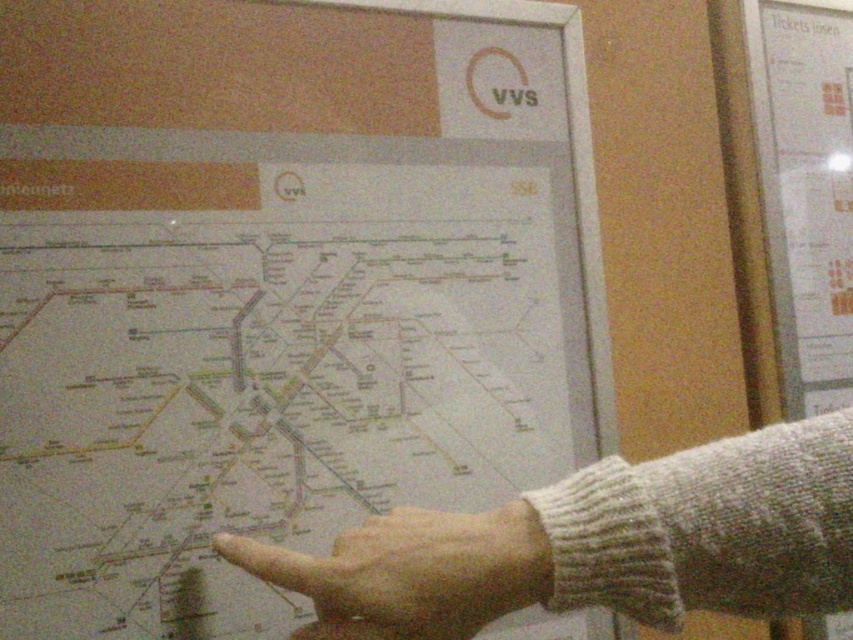
You are a tour guide explaining a map to tourists. You notice a white paper map at center and a skinny white finger at center. Which object is closer to you, the tour guide?

The white paper map at center is closer to you than the skinny white finger at center.

You are a delivery robot with a height of 24 inches. You are positioned in front of the screen showing the VVS transit map. The point you need to reach is at coordinate point (581, 566). Can you safely reach that point without exceeding your height limit?

The point (581, 566) is 19.56 inches away from the camera. Since the robot is 24 inches tall, it can safely reach the point as the distance is within its height limit.

You are a tour guide explaining a transit map to a tourist. You point at the map with your finger. According to the image, is your gray knitted sweater at center covering part of the map where your skinny white finger at center is pointing?

The gray knitted sweater at center is above the skinny white finger at center, so yes, the sweater is covering part of the map where the finger is pointing.